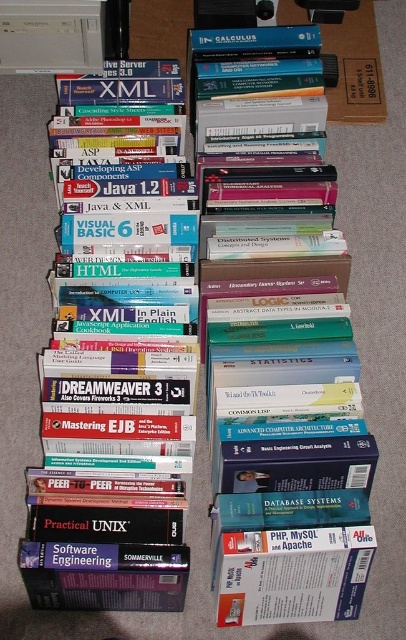
You are organizing a library and need to place the hardcover book at center and the hardcover book at left on a shelf. If the shelf has limited vertical space, which book should you place first to ensure both fit?

Place the hardcover book at left first since the hardcover book at center is above it, meaning it requires more vertical space. By placing the lower book first, you can stack the upper one on top without exceeding the shelf height limit.

Based on the photo, you are a student who needs to place a 6.5 inch ruler between the hardcover book at center and the matte white book at lower center. Can you fit the ruler between them without overlapping either book?

The distance between the hardcover book at center and the matte white book at lower center is 6.51 inches. Since the ruler is 6.5 inches long, it can fit between them with a slight gap, so yes, you can place the ruler there without overlapping either book.

Is the point at coordinates (282, 406) located on the hardcover book at center?

Yes, the point at coordinates (282, 406) is located on the hardcover book at center.